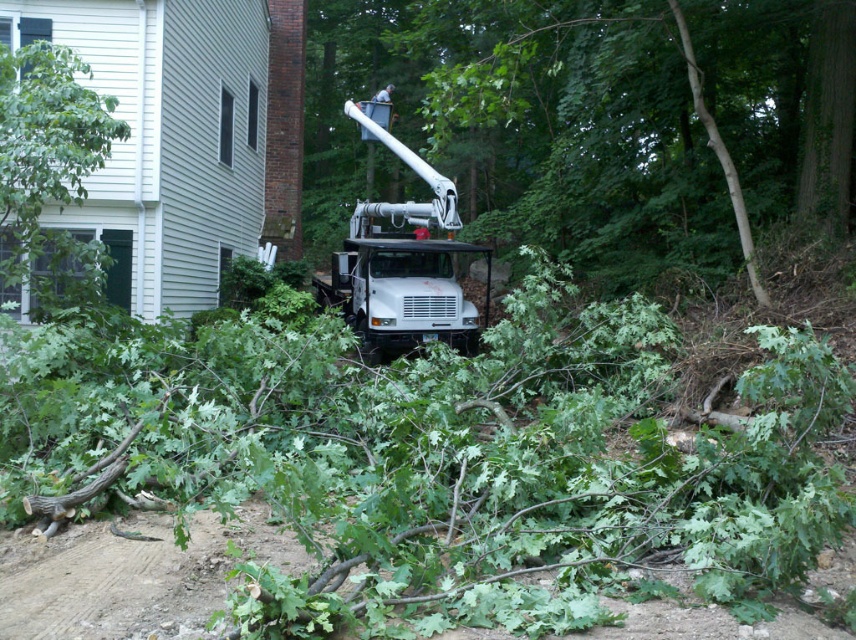
In order to click on green leafy tree at left in this screenshot , I will do (49, 170).

Where is `green leafy tree at left`? This screenshot has height=640, width=856. green leafy tree at left is located at coordinates (49, 170).

Is green leafy tree at center wider than green leafy tree at left?

Indeed, green leafy tree at center has a greater width compared to green leafy tree at left.

Is green leafy tree at center thinner than green leafy tree at left?

Incorrect, green leafy tree at center's width is not less than green leafy tree at left's.

Is point (569, 42) farther from camera compared to point (84, 102)?

Yes.

This screenshot has width=856, height=640. Find the location of `green leafy tree at center`. green leafy tree at center is located at coordinates (596, 120).

Who is more distant from viewer, (777, 122) or (447, 275)?

The point (777, 122) is more distant.

Does point (462, 182) lie in front of point (379, 273)?

No, (462, 182) is behind (379, 273).

Identify the location of green leafy tree at center. (596, 120).